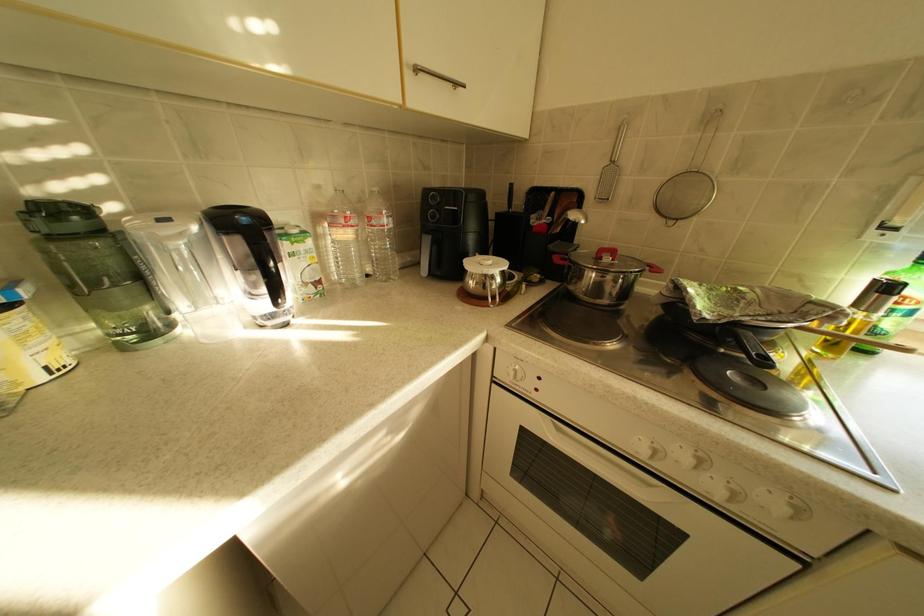
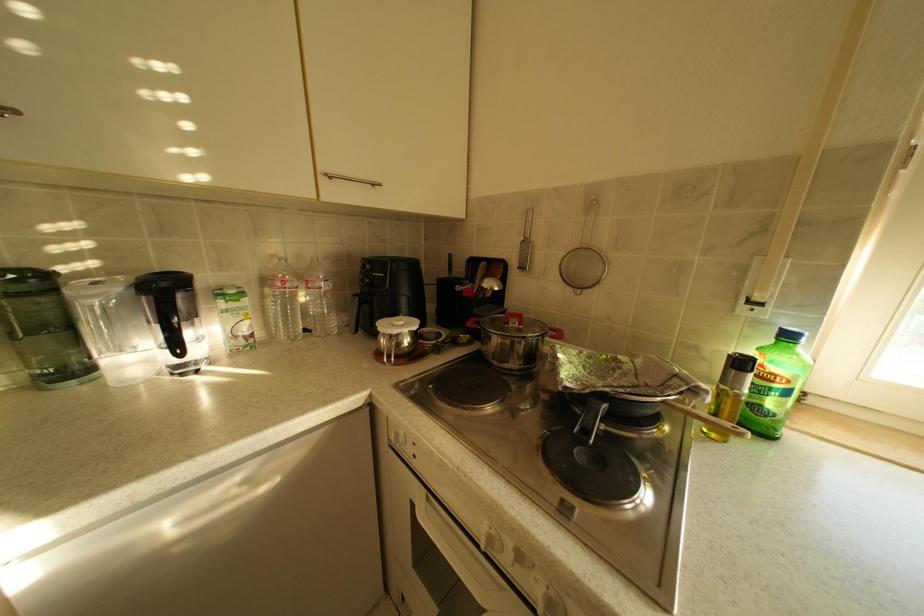
Question: How did the camera likely rotate?

Choices:
 (A) Left
 (B) Right
 (C) Up
 (D) Down

Answer: (C)